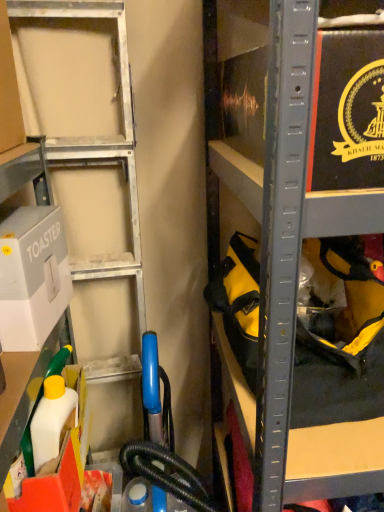
Question: Does white plastic bottle at lower left, which is counted as the first box, starting from the bottom, have a lesser height compared to white cardboard toaster at left, placed as the 1th box when sorted from top to bottom?

Choices:
 (A) yes
 (B) no

Answer: (A)

Question: Could you tell me if white plastic bottle at lower left, which is counted as the first box, starting from the bottom, is facing white cardboard toaster at left, placed as the 1th box when sorted from top to bottom?

Choices:
 (A) yes
 (B) no

Answer: (B)

Question: Can you confirm if white plastic bottle at lower left, the second box positioned from the top, is wider than white cardboard toaster at left, placed as the 1th box when sorted from top to bottom?

Choices:
 (A) no
 (B) yes

Answer: (B)

Question: Is white plastic bottle at lower left, the second box positioned from the top, positioned behind white cardboard toaster at left, placed as the 1th box when sorted from top to bottom?

Choices:
 (A) yes
 (B) no

Answer: (A)

Question: Is the depth of white plastic bottle at lower left, which is counted as the first box, starting from the bottom, less than that of white cardboard toaster at left, placed as the 1th box when sorted from top to bottom?

Choices:
 (A) no
 (B) yes

Answer: (A)

Question: From the image's perspective, would you say white plastic bottle at lower left, which is counted as the first box, starting from the bottom, is positioned over white cardboard toaster at left, placed as the 1th box when sorted from top to bottom?

Choices:
 (A) yes
 (B) no

Answer: (B)

Question: From a real-world perspective, is white cardboard toaster at left, placed as the 1th box when sorted from top to bottom, physically below white plastic bottle at lower left, which is counted as the first box, starting from the bottom?

Choices:
 (A) no
 (B) yes

Answer: (A)

Question: Considering the relative sizes of white cardboard toaster at left, positioned as the 2th box in bottom-to-top order, and white plastic bottle at lower left, the second box positioned from the top, in the image provided, is white cardboard toaster at left, positioned as the 2th box in bottom-to-top order, taller than white plastic bottle at lower left, the second box positioned from the top,?

Choices:
 (A) yes
 (B) no

Answer: (A)

Question: Are white cardboard toaster at left, positioned as the 2th box in bottom-to-top order, and white plastic bottle at lower left, the second box positioned from the top, located far from each other?

Choices:
 (A) no
 (B) yes

Answer: (A)

Question: Is white cardboard toaster at left, positioned as the 2th box in bottom-to-top order, aimed at white plastic bottle at lower left, which is counted as the first box, starting from the bottom?

Choices:
 (A) yes
 (B) no

Answer: (B)

Question: Can we say white cardboard toaster at left, positioned as the 2th box in bottom-to-top order, lies outside white plastic bottle at lower left, the second box positioned from the top?

Choices:
 (A) no
 (B) yes

Answer: (B)

Question: From the image's perspective, would you say white cardboard toaster at left, placed as the 1th box when sorted from top to bottom, is shown under white plastic bottle at lower left, the second box positioned from the top?

Choices:
 (A) yes
 (B) no

Answer: (B)

Question: From a real-world perspective, relative to white plastic bottle at lower left, the second box positioned from the top, is white cardboard toaster at left, placed as the 1th box when sorted from top to bottom, vertically above or below?

Choices:
 (A) below
 (B) above

Answer: (B)